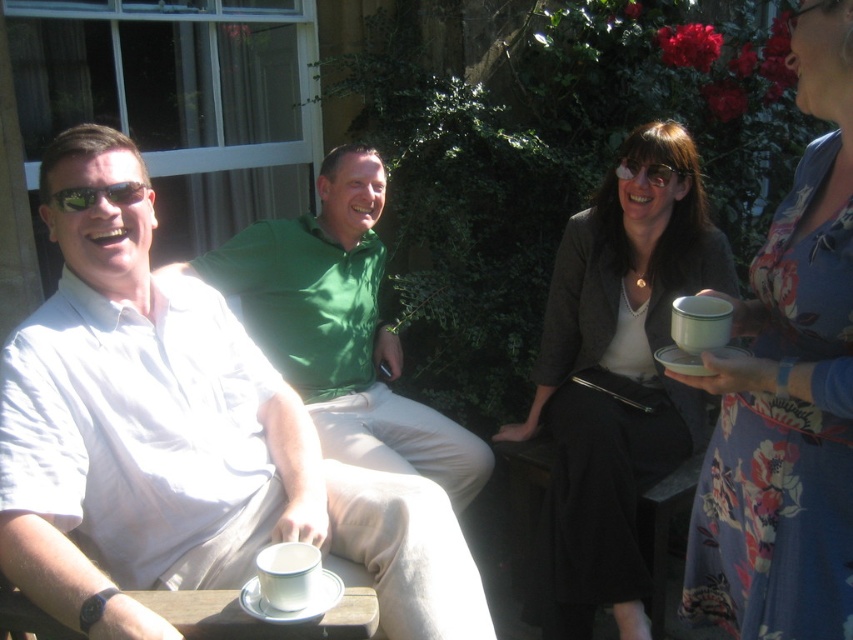
Is green shiny shirt at center to the left of matte black sunglasses at left from the viewer's perspective?

In fact, green shiny shirt at center is to the right of matte black sunglasses at left.

Who is more forward, (204, 276) or (140, 189)?

Point (140, 189)

Locate an element on the screen. The image size is (853, 640). green shiny shirt at center is located at coordinates point(341,330).

Which of these two, matte black jacket at center or green shiny shirt at center, stands shorter?

green shiny shirt at center

Can you confirm if matte black jacket at center is positioned below green shiny shirt at center?

Indeed, matte black jacket at center is positioned under green shiny shirt at center.

Measure the distance between matte black jacket at center and camera.

A distance of 7.44 feet exists between matte black jacket at center and camera.

Locate an element on the screen. matte black jacket at center is located at coordinates (618, 376).

Based on the photo, between matte black jacket at center and matte black sunglasses at left, which one is positioned lower?

matte black jacket at center is lower down.

Between matte black jacket at center and matte black sunglasses at left, which one is positioned higher?

matte black sunglasses at left

The width and height of the screenshot is (853, 640). What do you see at coordinates (618, 376) in the screenshot?
I see `matte black jacket at center` at bounding box center [618, 376].

Identify the location of matte black jacket at center. (618, 376).